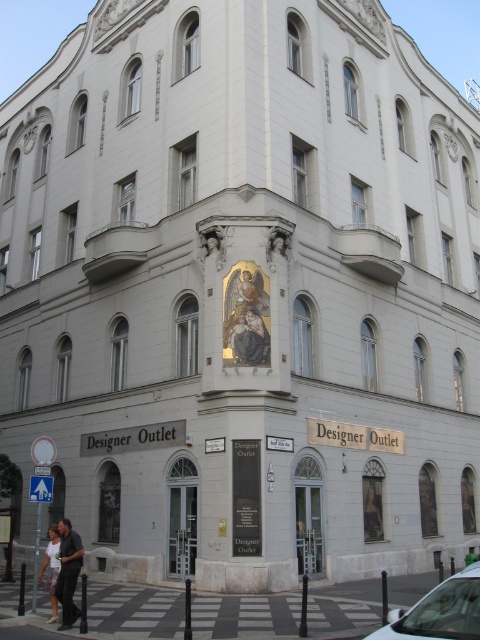
Who is more forward, (81, 554) or (51, 600)?

Point (81, 554)

Between dark gray pants at lower left and light pink fabric pants at lower left, which one is positioned lower?

light pink fabric pants at lower left

Which is in front, point (71, 618) or point (55, 552)?

Positioned in front is point (71, 618).

Image resolution: width=480 pixels, height=640 pixels. Identify the location of dark gray pants at lower left. (68, 572).